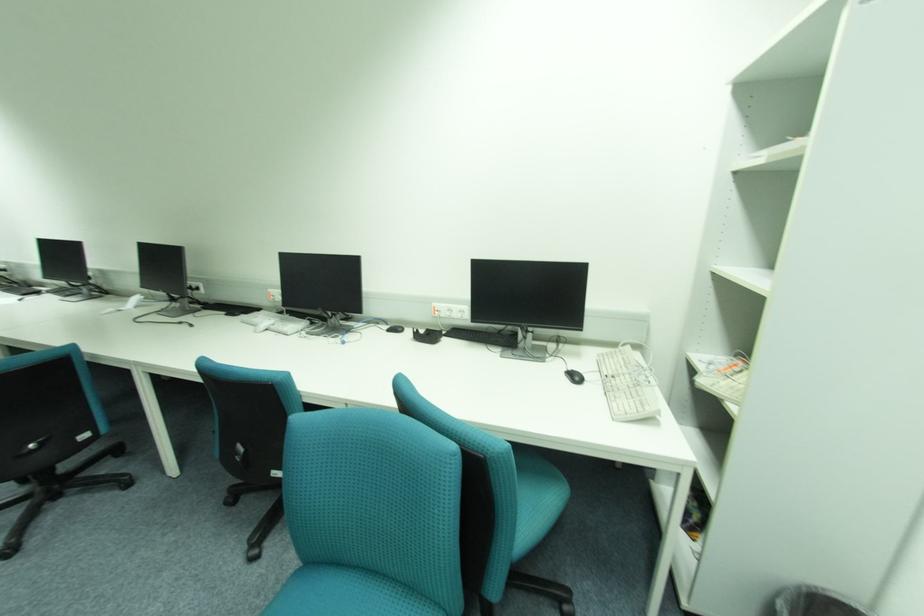
Identify the location of black computer mouse. The height and width of the screenshot is (616, 924). (574, 377).